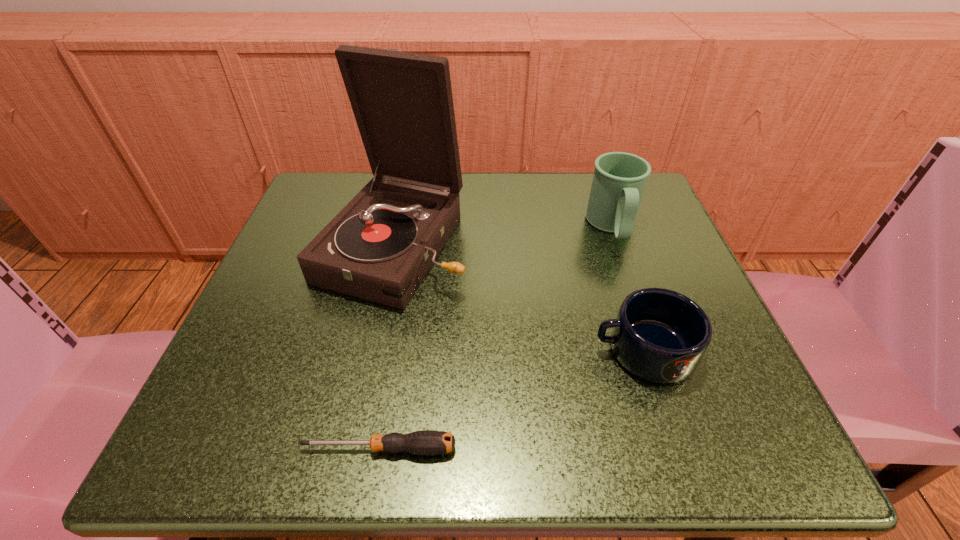
You are a GUI agent. You are given a task and a screenshot of the screen. Output one action in this format:
    pyautogui.click(x=<x>, y=<y>)
    Task: Click on the blank region between the shorter mug and the phonograph record
    The height and width of the screenshot is (540, 960).
    Given the screenshot: What is the action you would take?
    pyautogui.click(x=519, y=298)

Find the location of a particular element. vacant area between the third farthest object and the tallest object is located at coordinates (x=519, y=298).

The height and width of the screenshot is (540, 960). What are the coordinates of `free spot between the shortest object and the third shortest object` in the screenshot? It's located at [x=495, y=338].

The height and width of the screenshot is (540, 960). I want to click on vacant point located between the phonograph record and the farther mug, so click(x=503, y=237).

Find the location of `vacant space that is in between the phonograph record and the shortest object`. vacant space that is in between the phonograph record and the shortest object is located at coordinates (387, 347).

Where is `free space between the shortest object and the taller mug`? The image size is (960, 540). free space between the shortest object and the taller mug is located at coordinates (495, 338).

In order to click on vacant space in between the tallest object and the third shortest object in this screenshot , I will do `click(503, 237)`.

What are the coordinates of `object that is the third closest to the shorter mug` in the screenshot? It's located at (425, 442).

Locate an element on the screen. object that is the second closest to the shorter mug is located at coordinates (379, 247).

At what (x,y) coordinates should I click in order to perform the action: click on vacant space that satisfies the following two spatial constraints: 1. with the handle on the side of the second shortest object; 2. on the front side of the nearest object. Please return your answer as a coordinate pair (x, y). The width and height of the screenshot is (960, 540). Looking at the image, I should click on (676, 449).